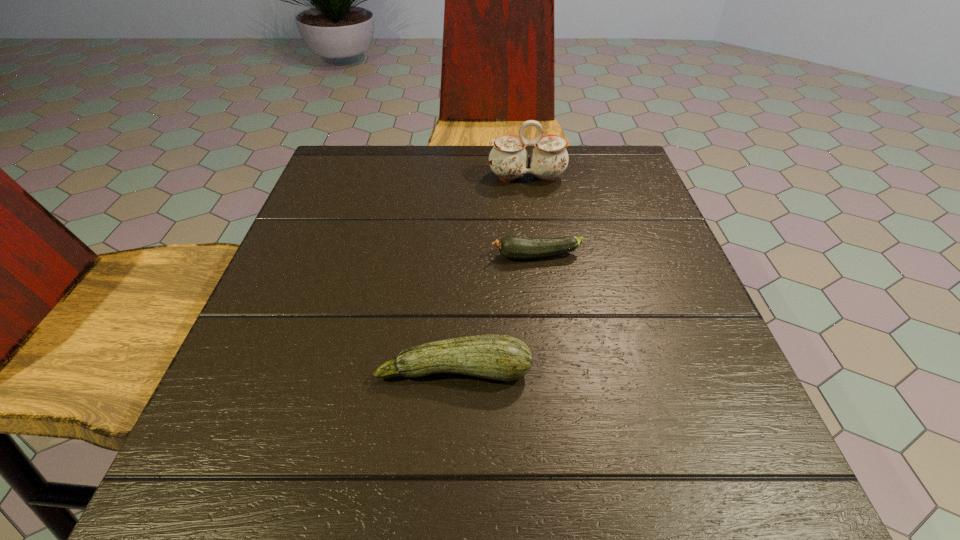
Identify the location of vacant space situated at the blossom end of the shortest object. (340, 256).

At what (x,y) coordinates should I click in order to perform the action: click on object situated at the far edge. Please return your answer as a coordinate pair (x, y). The width and height of the screenshot is (960, 540). Looking at the image, I should click on (508, 159).

Identify the location of free spot at the far edge of the desktop. (399, 154).

This screenshot has width=960, height=540. Find the location of `vacant space at the near edge of the desktop`. vacant space at the near edge of the desktop is located at coordinates (595, 465).

This screenshot has width=960, height=540. In the image, there is a desktop. What are the coordinates of `vacant space at the left edge` in the screenshot? It's located at (338, 259).

Where is `free space at the right edge of the desktop`? Image resolution: width=960 pixels, height=540 pixels. free space at the right edge of the desktop is located at coordinates (725, 398).

In the image, there is a desktop. Where is `free space at the far left corner`? This screenshot has height=540, width=960. free space at the far left corner is located at coordinates (333, 155).

Find the location of a particular element. This screenshot has height=540, width=960. free space at the near left corner of the desktop is located at coordinates (261, 488).

Identify the location of vacant space at the near right corner. This screenshot has width=960, height=540. (699, 472).

At what (x,y) coordinates should I click in order to perform the action: click on empty space that is in between the nearest object and the shorter zucchini. Please return your answer as a coordinate pair (x, y). Looking at the image, I should click on (495, 313).